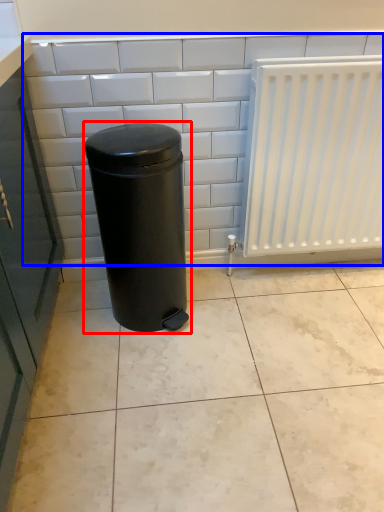
Question: Which of the following is the closest to the observer, waste container (highlighted by a red box) or ceramic tile (highlighted by a blue box)?

Choices:
 (A) waste container
 (B) ceramic tile

Answer: (A)